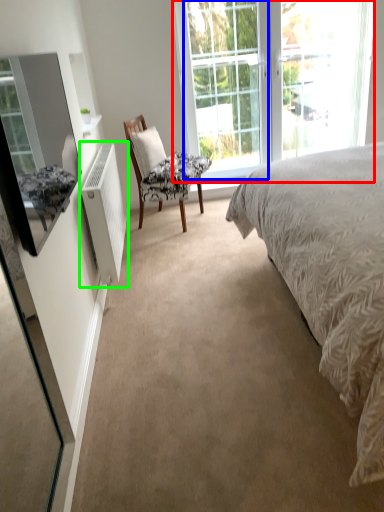
Question: Which object is positioned closest to window (highlighted by a red box)? Select from glass door (highlighted by a blue box) and radiator (highlighted by a green box).

Choices:
 (A) glass door
 (B) radiator

Answer: (A)